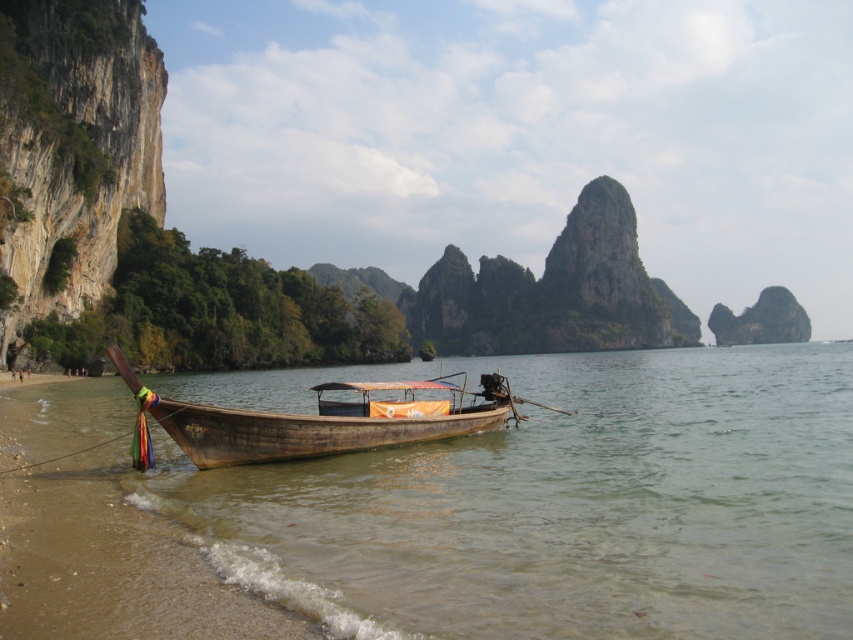
Which is more to the right, brown wooden water at lower left or wooden longboat at center?

brown wooden water at lower left is more to the right.

What do you see at coordinates (564, 506) in the screenshot?
I see `brown wooden water at lower left` at bounding box center [564, 506].

Does point (821, 368) come behind point (409, 406)?

Yes, point (821, 368) is behind point (409, 406).

What are the coordinates of `brown wooden water at lower left` in the screenshot? It's located at (564, 506).